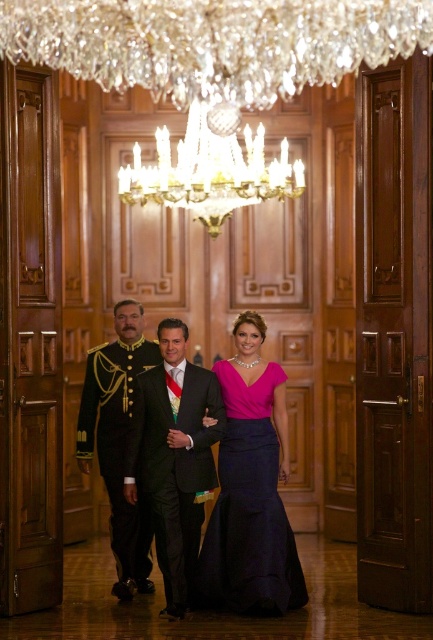
You are a photographer preparing to take a group photo of the individuals in the scene. You need to ensure that both the matte pink dress at center and the purple satin dress at center are clearly visible. Given their sizes, which dress should be placed closer to the camera to avoid being obscured?

The purple satin dress at center is smaller than the matte pink dress at center, so placing the purple satin dress at center closer to the camera would ensure it remains visible and not overshadowed by the larger matte pink dress at center.

You are a photographer positioned at the back of the hall. You need to take a photo that includes both the purple satin dress at center and the shiny black uniform at center. Based on their positions, which one should you adjust your camera angle to focus on first to ensure both are in frame?

The purple satin dress at center is to the right of the shiny black uniform at center, so you should adjust your camera angle to focus on the shiny black uniform at center first, then pan to include the purple satin dress at center to the right.

You are attending a formal event in this grand hall and notice two central figures wearing the purple satin dress at center and the shiny black uniform at center. Which one is lower in position from the viewer?

The purple satin dress at center is positioned under the shiny black uniform at center, so it is lower in position from the viewer.